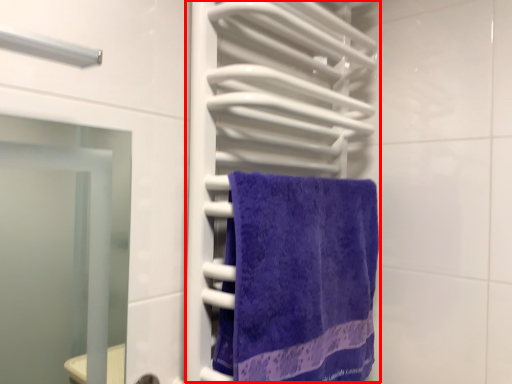
Question: From the image's perspective, what is the correct spatial positioning of closet (annotated by the red box) in reference to towel?

Choices:
 (A) above
 (B) below

Answer: (A)